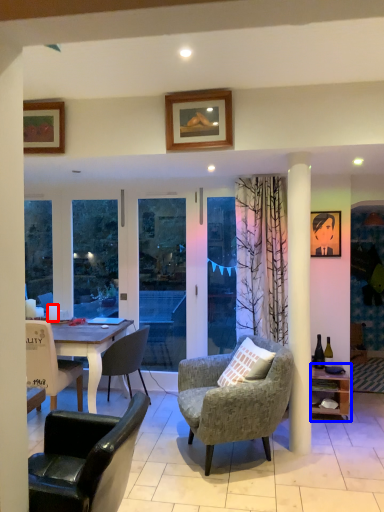
Question: Which object appears farthest to the camera in this image, coffee cup (highlighted by a red box) or shelf (highlighted by a blue box)?

Choices:
 (A) coffee cup
 (B) shelf

Answer: (A)